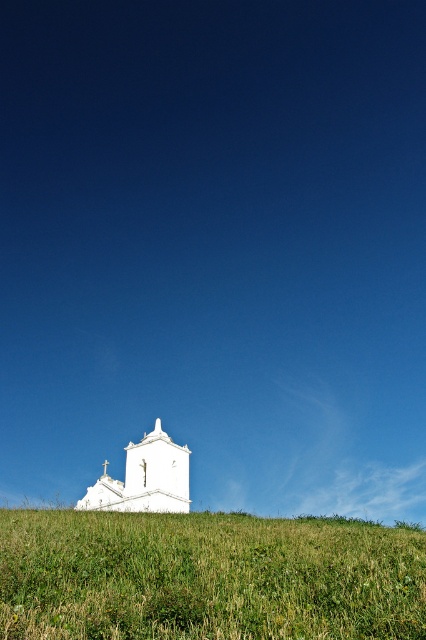
In the scene shown: Is green grassy hillside at lower center below white smooth church at lower center?

Incorrect, green grassy hillside at lower center is not positioned below white smooth church at lower center.

Does green grassy hillside at lower center have a lesser height compared to white smooth church at lower center?

Yes.

Between point (149, 529) and point (175, 490), which one is positioned in front?

Positioned in front is point (149, 529).

This screenshot has width=426, height=640. What are the coordinates of `green grassy hillside at lower center` in the screenshot? It's located at pos(207,577).